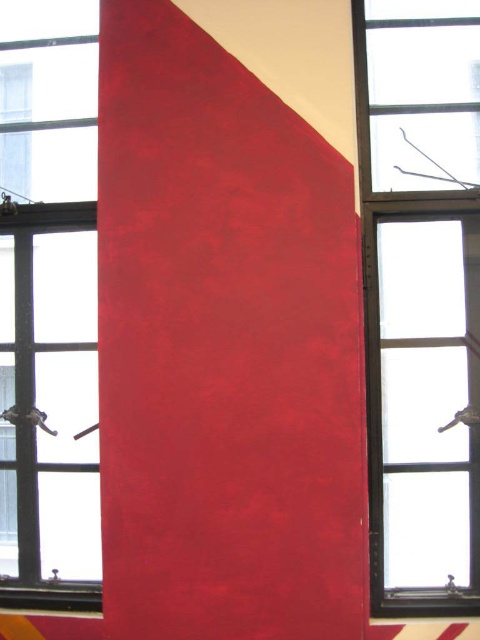
Question: Which point is farther to the camera?

Choices:
 (A) (430, 388)
 (B) (16, 280)

Answer: (B)

Question: Is clear glass window at center thinner than transparent glass window at center?

Choices:
 (A) no
 (B) yes

Answer: (A)

Question: Among these objects, which one is nearest to the camera?

Choices:
 (A) transparent glass window at center
 (B) clear glass window at center

Answer: (B)

Question: Does clear glass window at center have a lesser width compared to transparent glass window at center?

Choices:
 (A) yes
 (B) no

Answer: (B)

Question: Which object is closer to the camera taking this photo?

Choices:
 (A) transparent glass window at center
 (B) clear glass window at center

Answer: (B)

Question: Is clear glass window at center wider than transparent glass window at center?

Choices:
 (A) no
 (B) yes

Answer: (B)